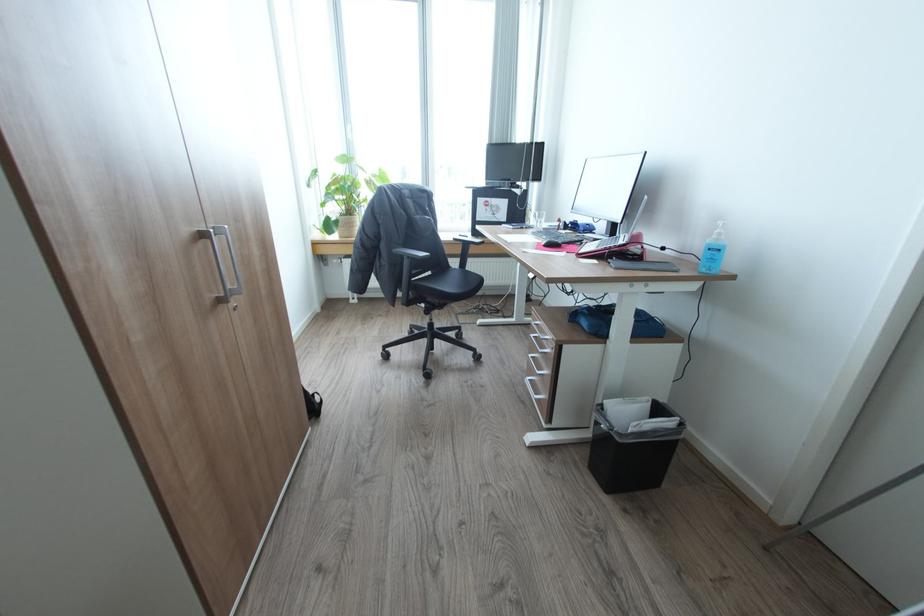
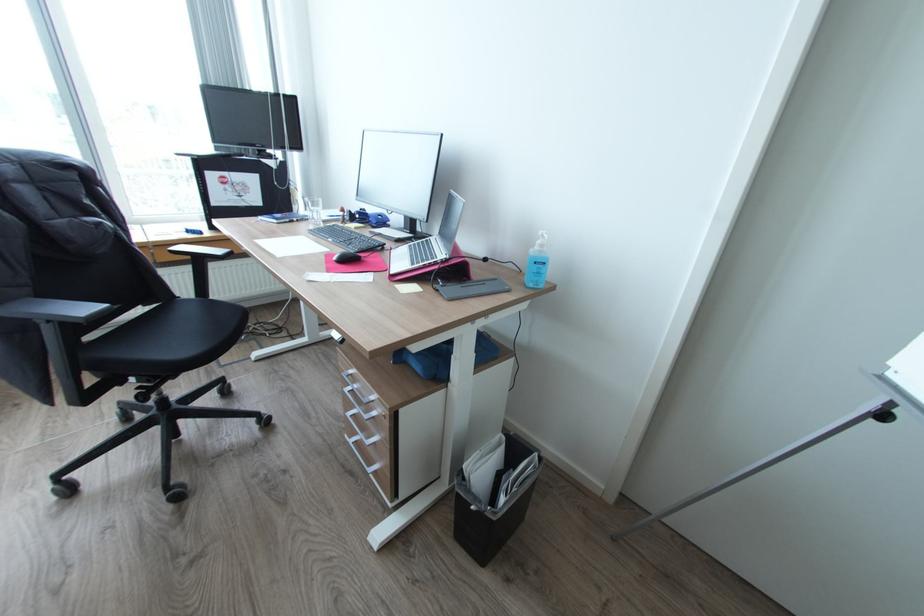
Locate, in the second image, the point that corresponds to point 708,270 in the first image.

(536, 284)